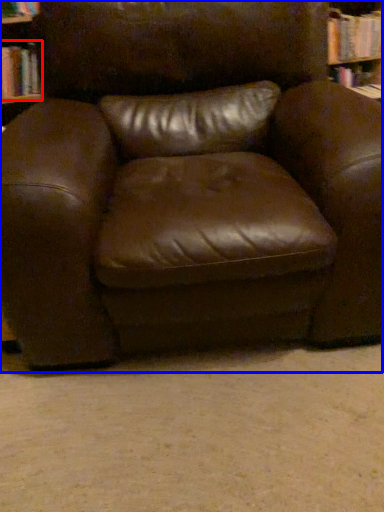
Question: Which of the following is the closest to the observer, book (highlighted by a red box) or chair (highlighted by a blue box)?

Choices:
 (A) book
 (B) chair

Answer: (B)